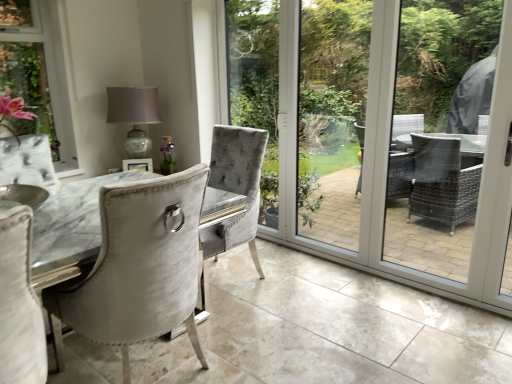
The image size is (512, 384). In order to click on vacant space in front of white glossy screen door at right, which is the second screen door in left-to-right order in this screenshot , I will do `click(499, 327)`.